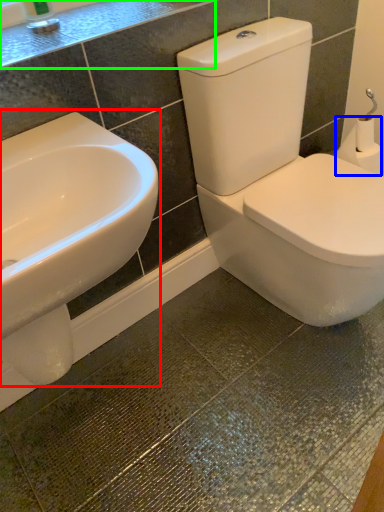
Question: Which object is the closest to the sink (highlighted by a red box)? Choose among these: toilet paper (highlighted by a blue box) or counter top (highlighted by a green box).

Choices:
 (A) toilet paper
 (B) counter top

Answer: (B)